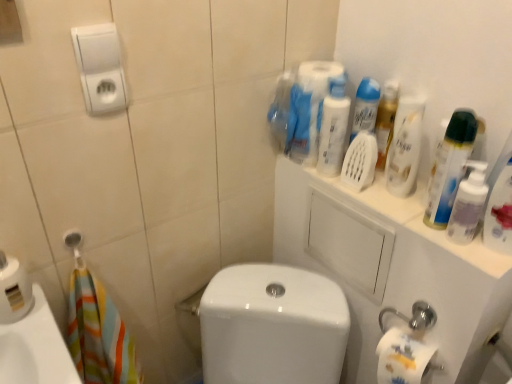
Identify the location of vacant region in front of translucent plastic bottle at upper right, acting as the first cleaning product starting from the left. click(x=373, y=203).